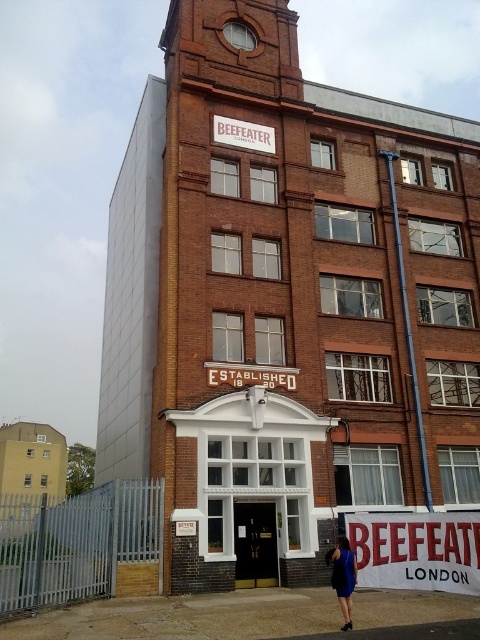
Based on the photo, you are standing in front of the building and want to read both the white painted wood sign at center and the white wooden sign at upper center. Which sign will you need to look up higher to read?

The white wooden sign at upper center requires looking up higher because it is taller than the white painted wood sign at center.

You are standing in front of the building and want to read both the white painted wood sign at center and the white wooden sign at upper center. Which sign will you need to look up to see?

You will need to look up to see the white wooden sign at upper center because it is further away from you compared to the white painted wood sign at center, which is closer.